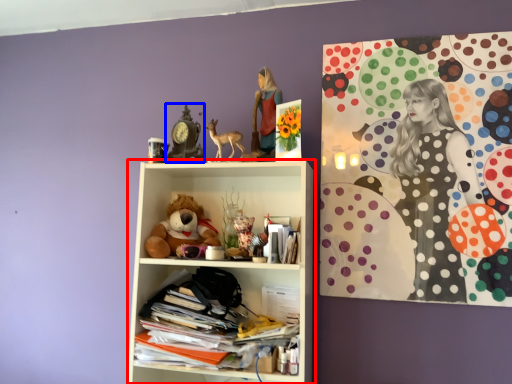
Question: Which point is closer to the camera, shelf (highlighted by a red box) or art (highlighted by a blue box)?

Choices:
 (A) shelf
 (B) art

Answer: (A)